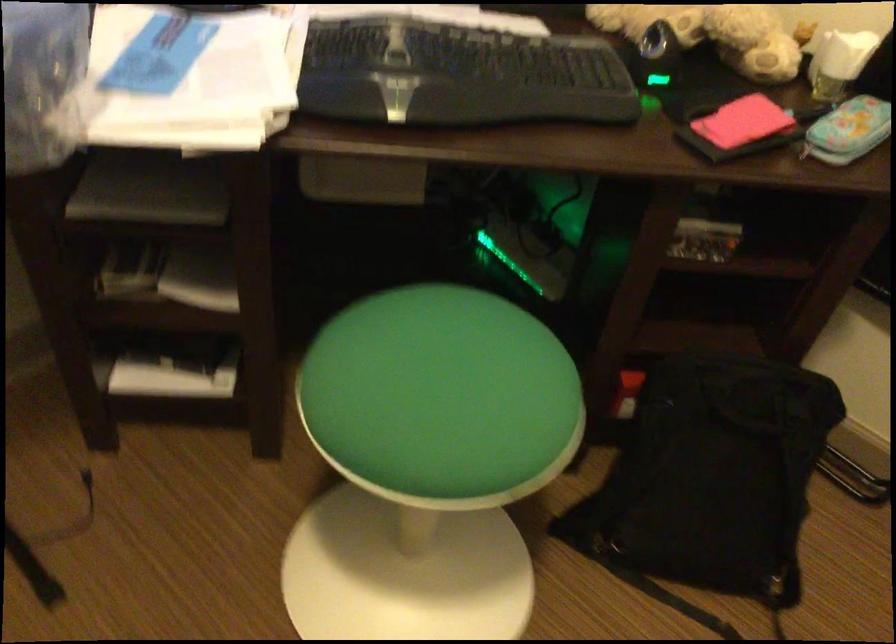
Identify the location of small glass cup. Image resolution: width=896 pixels, height=644 pixels. (828, 89).